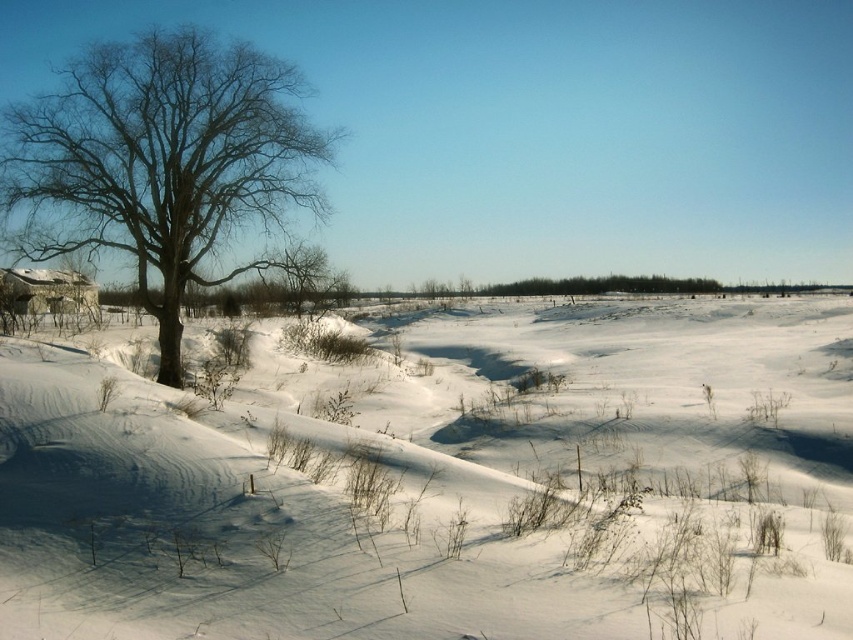
Does white fluffy snow at center have a greater width compared to bare branches at left?

Correct, the width of white fluffy snow at center exceeds that of bare branches at left.

Is point (705, 442) positioned before point (131, 212)?

Yes, it is.

The height and width of the screenshot is (640, 853). In order to click on white fluffy snow at center in this screenshot , I will do `click(439, 484)`.

Is point (106, 170) positioned behind point (68, 300)?

No, (106, 170) is closer to viewer.

Image resolution: width=853 pixels, height=640 pixels. Identify the location of bare branches at left. (160, 161).

At what (x,y) coordinates should I click in order to perform the action: click on bare branches at left. Please return your answer as a coordinate pair (x, y). This screenshot has width=853, height=640. Looking at the image, I should click on (160, 161).

Is white fluffy snow at center to the right of gray stone hut at left from the viewer's perspective?

Indeed, white fluffy snow at center is positioned on the right side of gray stone hut at left.

Who is taller, white fluffy snow at center or gray stone hut at left?

white fluffy snow at center is taller.

This screenshot has height=640, width=853. Describe the element at coordinates (439, 484) in the screenshot. I see `white fluffy snow at center` at that location.

You are a GUI agent. You are given a task and a screenshot of the screen. Output one action in this format:
    pyautogui.click(x=<x>, y=<y>)
    Task: Click on the white fluffy snow at center
    This screenshot has width=853, height=640.
    Given the screenshot: What is the action you would take?
    pyautogui.click(x=439, y=484)